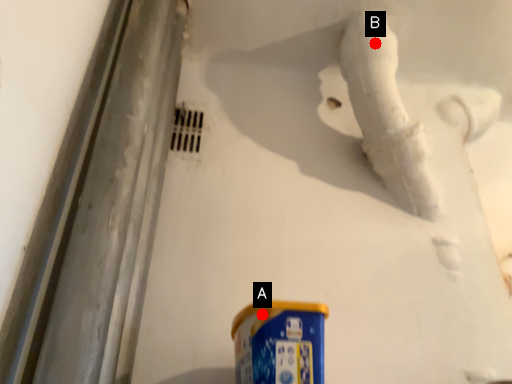
Question: Two points are circled on the image, labeled by A and B beside each circle. Among these points, which one is farthest from the camera?

Choices:
 (A) A is further
 (B) B is further

Answer: (B)